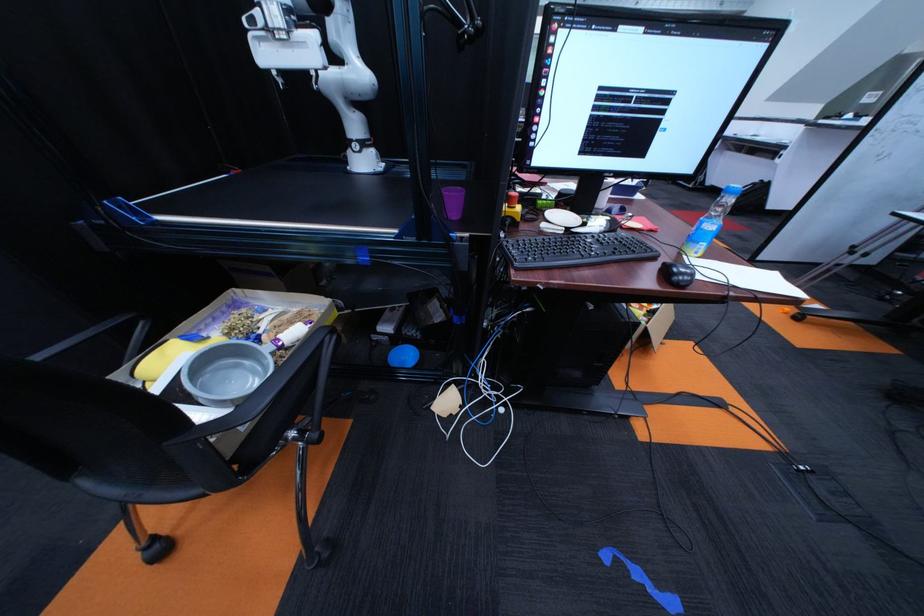
Find the location of a particular element. This screenshot has height=616, width=924. yellow stop button is located at coordinates (167, 355).